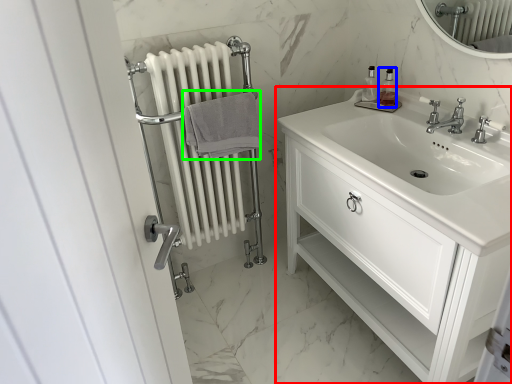
Question: Estimate the real-world distances between objects in this image. Which object is farther from bathroom cabinet (highlighted by a red box), soap dispenser (highlighted by a blue box) or bath towel (highlighted by a green box)?

Choices:
 (A) soap dispenser
 (B) bath towel

Answer: (A)